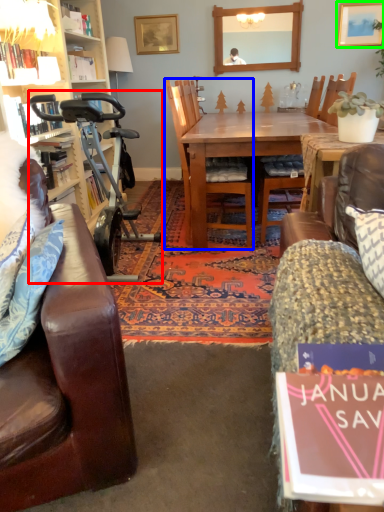
Question: Which is nearer to the mobility scooter (highlighted by a red box)? chair (highlighted by a blue box) or picture frame (highlighted by a green box).

Choices:
 (A) chair
 (B) picture frame

Answer: (A)